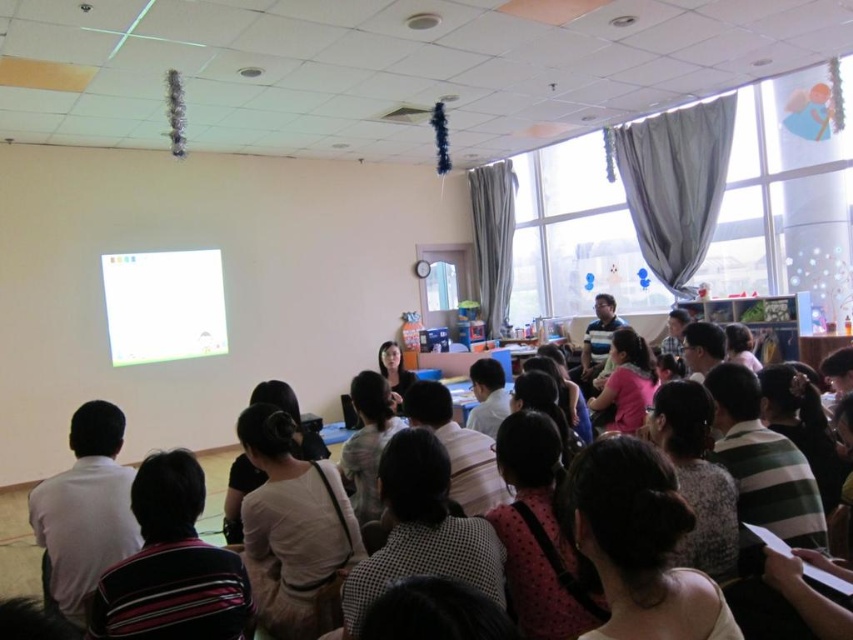
Is white shirt at center to the left of white glossy projector screen at upper left from the viewer's perspective?

In fact, white shirt at center is to the right of white glossy projector screen at upper left.

Where is `white shirt at center`? The width and height of the screenshot is (853, 640). white shirt at center is located at coordinates (85, 509).